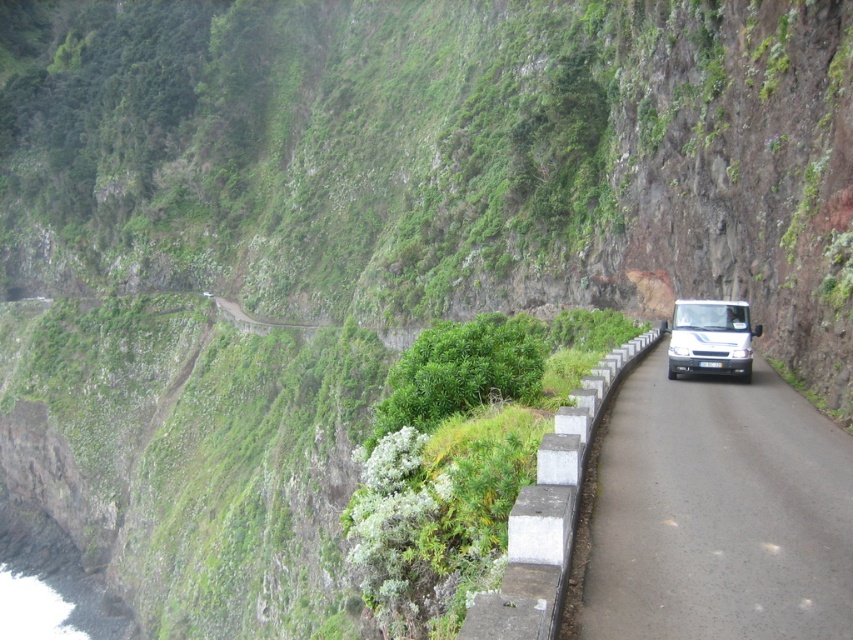
This screenshot has height=640, width=853. Describe the element at coordinates (718, 513) in the screenshot. I see `black asphalt road at right` at that location.

This screenshot has height=640, width=853. What are the coordinates of `black asphalt road at right` in the screenshot? It's located at (718, 513).